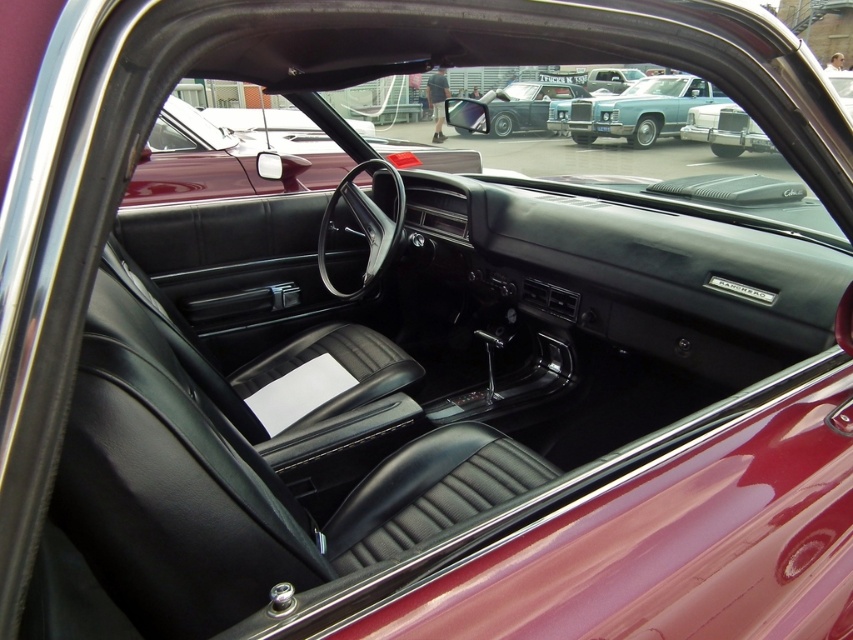
Looking at this image, you are a delivery person trying to park a 6.5 feet wide delivery van between the shiny blue sedan at upper center and the shiny chrome car at upper center. Can the van fit through the space between them?

The space between the shiny blue sedan at upper center and the shiny chrome car at upper center is 6.66 feet. Since the delivery van is 6.5 feet wide, it can fit through the space as it is slightly narrower than the available space.

You are sitting in the driver seat of the shiny blue sedan at upper center and want to reach the shiny chrome car at upper center. Which direction should you move your hand to touch it?

You should move your hand forward because the shiny blue sedan at upper center is closer to you than the shiny chrome car at upper center, so to reach the latter, you need to extend your hand towards the front.

You are a photographer setting up a shoot inside the car. You need to position a light source between the glossy maroon car at center and the shiny chrome car at upper center. Which car should the light be placed closer to if you want it to illuminate the taller object?

The glossy maroon car at center is not as tall as the shiny chrome car at upper center, so the light should be placed closer to the shiny chrome car at upper center to effectively illuminate the taller object.